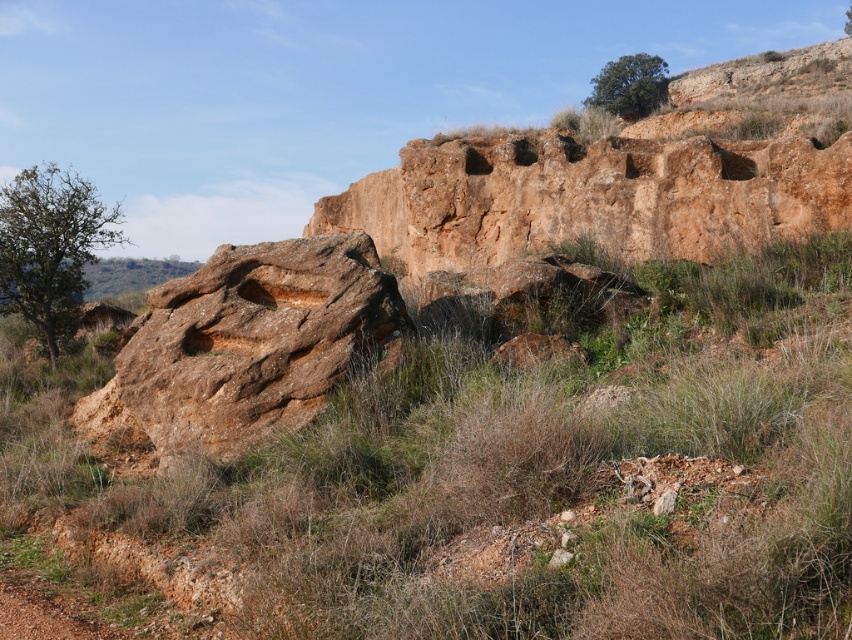
Can you confirm if brown rough rock at center is positioned to the right of brown dirt track at lower left?

Yes, brown rough rock at center is to the right of brown dirt track at lower left.

Between point (291, 310) and point (22, 595), which one is positioned behind?

Point (291, 310)

Where is `brown rough rock at center`? brown rough rock at center is located at coordinates (251, 340).

Is brown rock at center closer to the viewer compared to brown rough rock at center?

That is True.

What do you see at coordinates (511, 472) in the screenshot? I see `brown rock at center` at bounding box center [511, 472].

This screenshot has width=852, height=640. I want to click on brown rock at center, so click(511, 472).

Can you confirm if brown rock at center is smaller than brown dirt track at lower left?

Correct, brown rock at center occupies less space than brown dirt track at lower left.

The width and height of the screenshot is (852, 640). Describe the element at coordinates (511, 472) in the screenshot. I see `brown rock at center` at that location.

Who is more forward, (769, 436) or (44, 627)?

Point (44, 627)

The image size is (852, 640). Identify the location of brown rock at center. (511, 472).